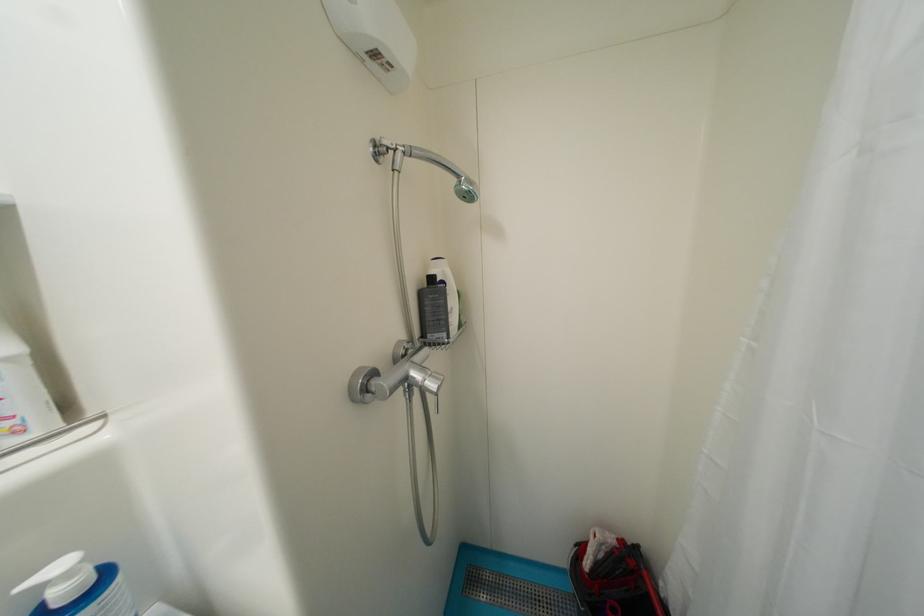
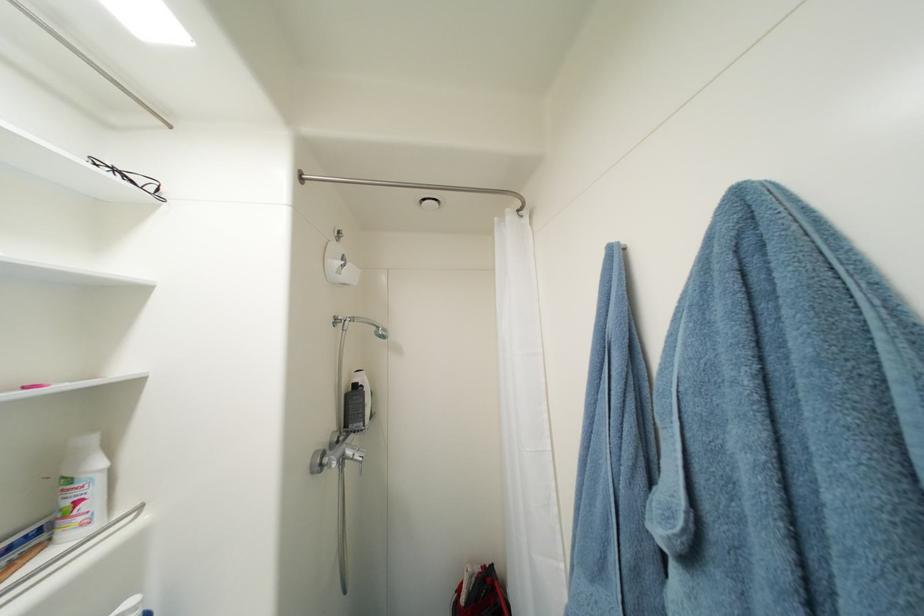
The point at (x=439, y=281) is marked in the first image. Where is the corresponding point in the second image?

(361, 387)